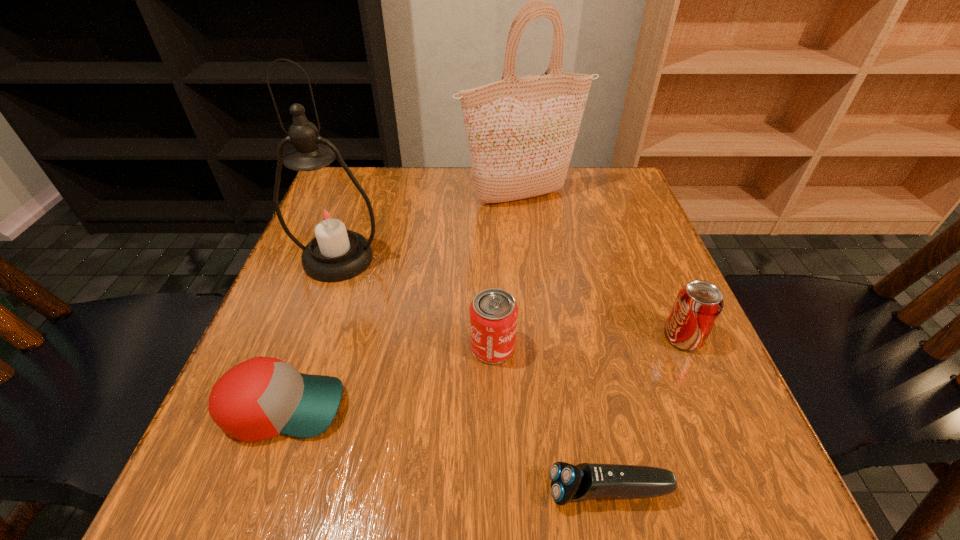
You are a GUI agent. You are given a task and a screenshot of the screen. Output one action in this format:
    pyautogui.click(x=<x>, y=<y>)
    Task: Click on the shopping bag
    This screenshot has height=540, width=960.
    Given the screenshot: What is the action you would take?
    pyautogui.click(x=521, y=132)

The image size is (960, 540). What are the coordinates of `the second farthest object` in the screenshot? It's located at coord(325,214).

The width and height of the screenshot is (960, 540). I want to click on the rightmost object, so click(698, 305).

The height and width of the screenshot is (540, 960). I want to click on can, so click(x=493, y=312).

Find the location of a particular element. This screenshot has height=540, width=960. the fifth farthest object is located at coordinates (263, 397).

You are a GUI agent. You are given a task and a screenshot of the screen. Output one action in this format:
    pyautogui.click(x=<x>, y=<y>)
    Task: Click on the second shortest object
    
    Given the screenshot: What is the action you would take?
    pyautogui.click(x=263, y=397)

This screenshot has height=540, width=960. I want to click on the nearest object, so click(569, 483).

I want to click on the shortest object, so click(569, 483).

Locate an element on the screen. Image resolution: width=960 pixels, height=540 pixels. free region located on the right of the farthest object is located at coordinates (618, 198).

This screenshot has width=960, height=540. In order to click on vacant space located 0.050m on the right of the fifth nearest object in this screenshot , I will do `click(406, 259)`.